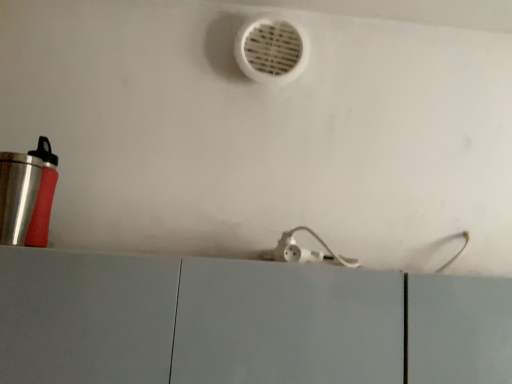
You are a GUI agent. You are given a task and a screenshot of the screen. Output one action in this format:
    pyautogui.click(x=<x>, y=<y>)
    Task: Click on the matte gray cabinet at bottom
    
    Given the screenshot: What is the action you would take?
    pyautogui.click(x=195, y=321)

The height and width of the screenshot is (384, 512). What do you see at coordinates (195, 321) in the screenshot? I see `matte gray cabinet at bottom` at bounding box center [195, 321].

Locate an element on the screen. Image resolution: width=512 pixels, height=384 pixels. matte gray cabinet at bottom is located at coordinates (195, 321).